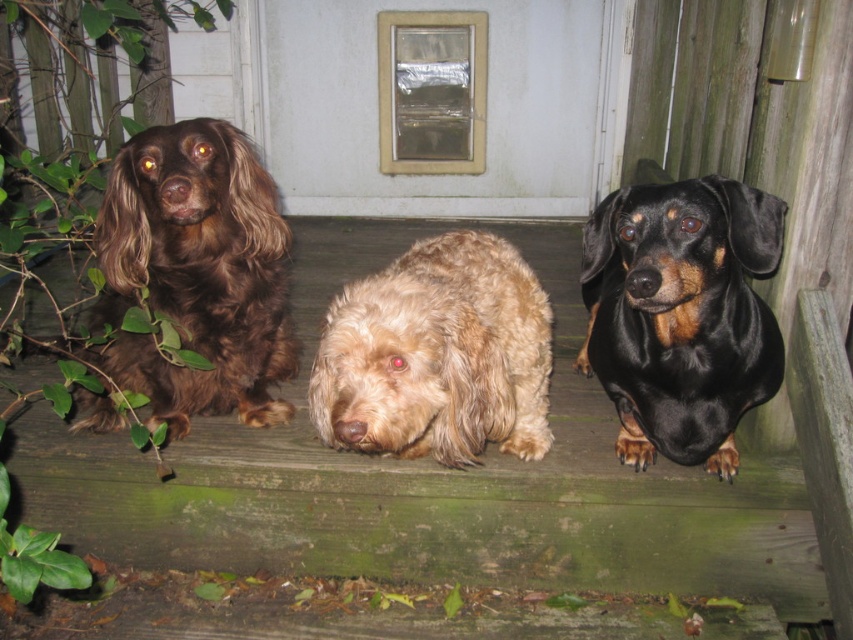
Does shiny brown fur at left have a larger size compared to black shiny dog at center?

Actually, shiny brown fur at left might be smaller than black shiny dog at center.

Image resolution: width=853 pixels, height=640 pixels. What do you see at coordinates (196, 273) in the screenshot? I see `shiny brown fur at left` at bounding box center [196, 273].

Is point (224, 276) more distant than point (614, 273)?

No, it is in front of (614, 273).

You are a GUI agent. You are given a task and a screenshot of the screen. Output one action in this format:
    pyautogui.click(x=<x>, y=<y>)
    Task: Click on the shiny brown fur at left
    
    Given the screenshot: What is the action you would take?
    pyautogui.click(x=196, y=273)

Is black shiny dog at center bigger than fuzzy beige dog at center?

Correct, black shiny dog at center is larger in size than fuzzy beige dog at center.

The image size is (853, 640). Identify the location of black shiny dog at center. (682, 316).

Image resolution: width=853 pixels, height=640 pixels. Find the location of `black shiny dog at center`. black shiny dog at center is located at coordinates (682, 316).

From the picture: Which is below, shiny brown fur at left or fuzzy beige dog at center?

Positioned lower is fuzzy beige dog at center.

Who is more distant from viewer, [135,227] or [483,260]?

The point [483,260] is behind.

Which is in front, point (271, 417) or point (328, 394)?

Point (328, 394)

Where is `shiny brown fur at left`? shiny brown fur at left is located at coordinates (196, 273).